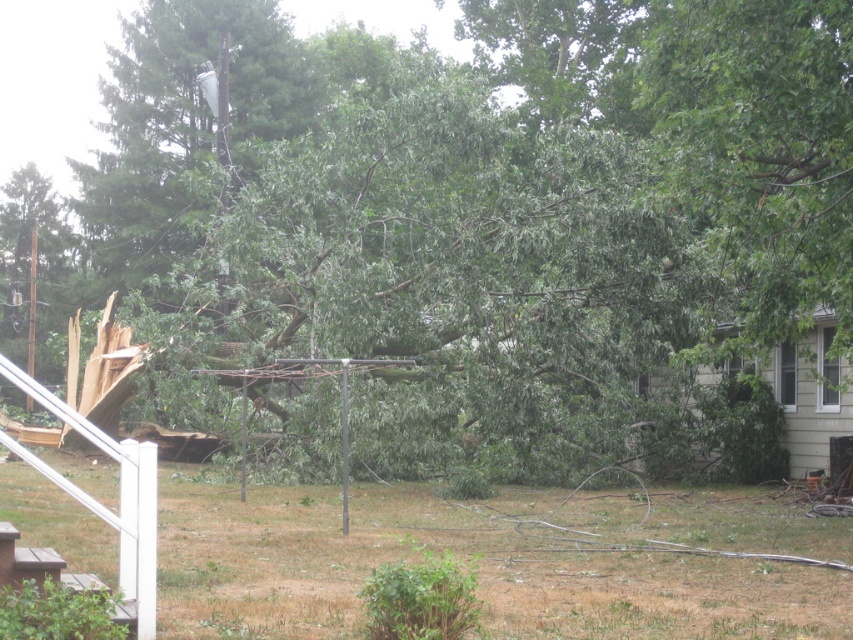
You are a landscape gardener assessing the damage after a storm. You notice the brown grass at lower center. Based on its location, can you determine if it is closer to the white picket fence on the left or the uprooted tree in the yard?

The brown grass at lower center is located at point (500, 560), which is closer to the uprooted tree in the yard than the white picket fence on the left.

You are a landscape gardener assessing the damage after a storm. You see the brown grass at lower center and the green leafy tree at upper right. Which of these two elements is located to the left of the other?

The brown grass at lower center is positioned on the left side of green leafy tree at upper right.

You are standing in the yard looking at the uprooted tree and the two points marked in the image. Which point, point (556, 627) or point (743, 54), is closer to you?

Point (556, 627) is closer to the viewer than point (743, 54).